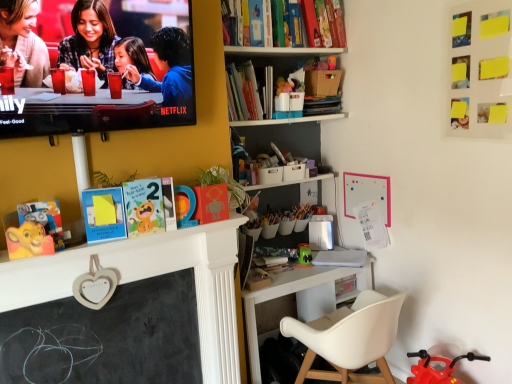
At what (x,y) coordinates should I click in order to perform the action: click on free space in front of green matte toy at center. Please return your answer as a coordinate pair (x, y). The width and height of the screenshot is (512, 384). Looking at the image, I should click on [316, 274].